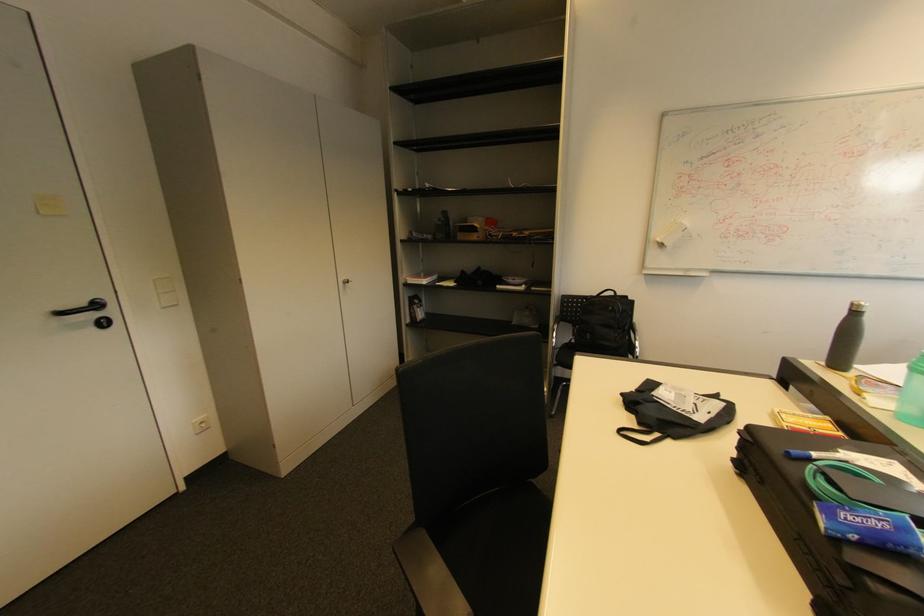
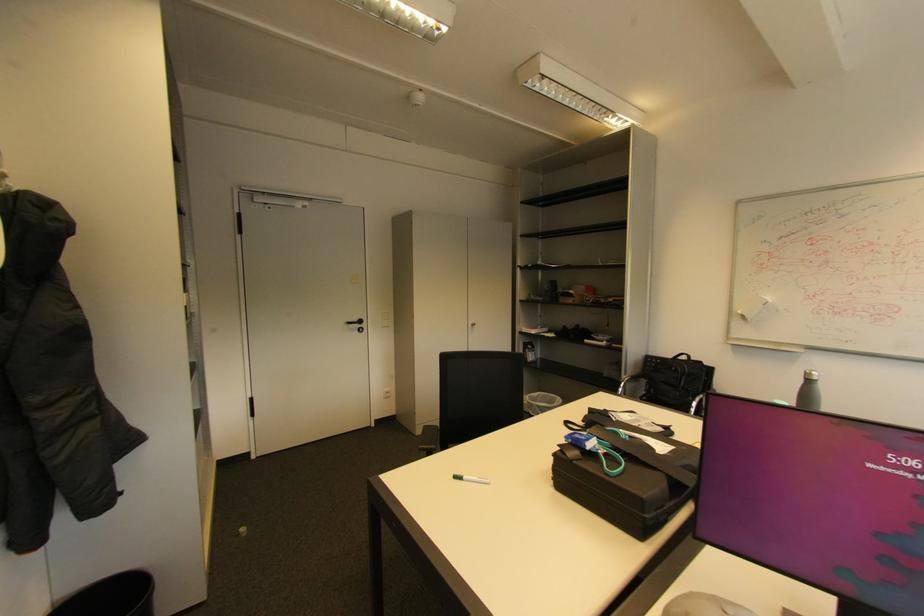
In the second image, find the point that corresponds to point 857,305 in the first image.

(811, 373)